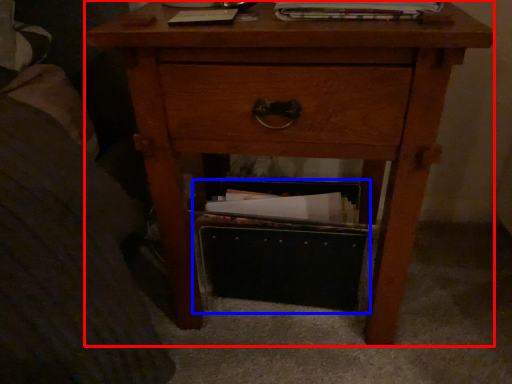
Question: Which object appears closest to the camera in this image, nightstand (highlighted by a red box) or shoe box (highlighted by a blue box)?

Choices:
 (A) nightstand
 (B) shoe box

Answer: (A)